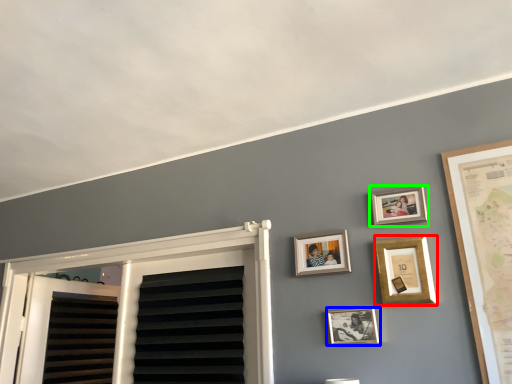
Question: Based on their relative distances, which object is nearer to picture frame (highlighted by a red box)? Choose from picture frame (highlighted by a blue box) and picture frame (highlighted by a green box).

Choices:
 (A) picture frame
 (B) picture frame

Answer: (B)